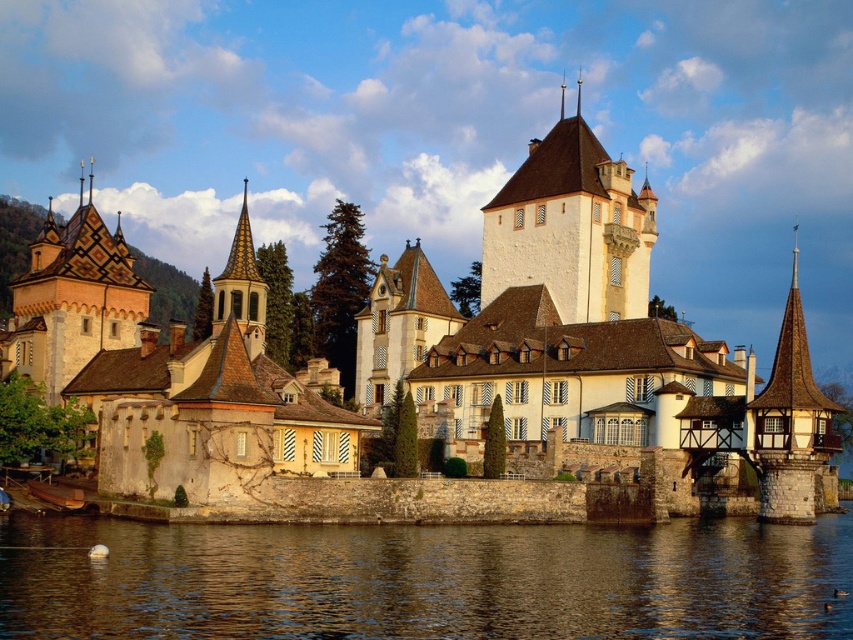
You are standing at the mainland and looking towards the castle. There are two points marked on the castle complex. Which point, point (537, 356) or point (822, 592), is closer to you?

Point (822, 592) is closer to you because it is in front of point (537, 356).

You are standing on the mainland and see the white stone castle at center and the brown water at lower center. Which object is closer to your left side?

The white stone castle at center is to the left of the brown water at lower center, so from your perspective on the mainland, the white stone castle at center would be closer to your left side.